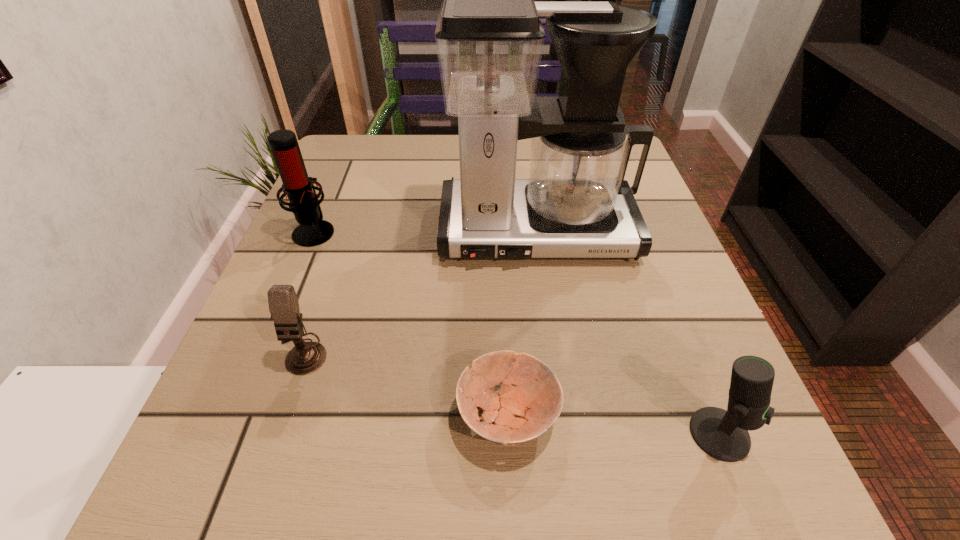
Select which object is the fourth closest to the rightmost microphone. Please provide its 2D coordinates. Your answer should be formatted as a tuple, i.e. [(x, y)], where the tuple contains the x and y coordinates of a point satisfying the conditions above.

[(313, 230)]

Point out which object is positioned as the second nearest to the rightmost microphone. Please provide its 2D coordinates. Your answer should be formatted as a tuple, i.e. [(x, y)], where the tuple contains the x and y coordinates of a point satisfying the conditions above.

[(575, 203)]

What are the coordinates of `the closest microphone to the second tallest object` in the screenshot? It's located at tap(304, 358).

Identify which microphone is the second closest to the bowl. Please provide its 2D coordinates. Your answer should be formatted as a tuple, i.e. [(x, y)], where the tuple contains the x and y coordinates of a point satisfying the conditions above.

[(304, 358)]

Find the location of a particular element. This screenshot has height=540, width=960. vacant region that satisfies the following two spatial constraints: 1. on the front-facing side of the second nearest microphone; 2. on the left side of the shortest object is located at coordinates (281, 416).

Locate an element on the screen. free space that satisfies the following two spatial constraints: 1. on the front side of the rightmost microphone; 2. on the left side of the bowl is located at coordinates click(x=509, y=434).

Where is `free space that satisfies the following two spatial constraints: 1. on the front-facing side of the shortest object; 2. on the left side of the second farthest microphone`? The width and height of the screenshot is (960, 540). free space that satisfies the following two spatial constraints: 1. on the front-facing side of the shortest object; 2. on the left side of the second farthest microphone is located at coordinates (281, 416).